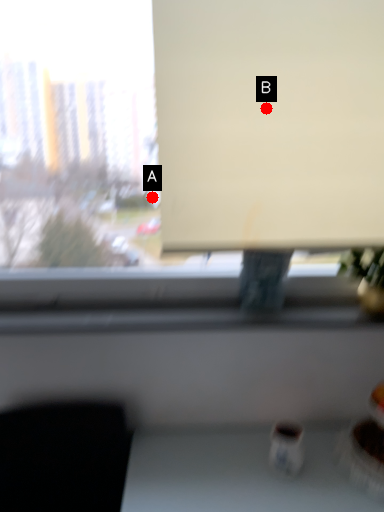
Question: Two points are circled on the image, labeled by A and B beside each circle. Which point is farther from the camera taking this photo?

Choices:
 (A) A is further
 (B) B is further

Answer: (A)